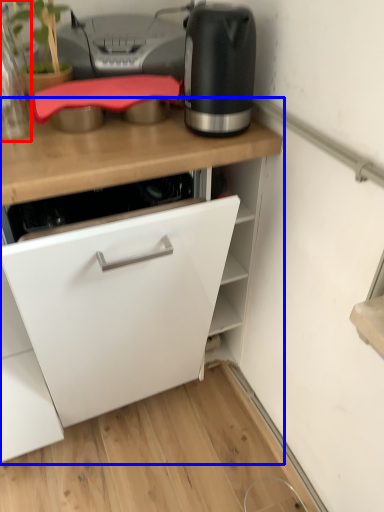
Question: Among these objects, which one is nearest to the camera, kitchen appliance (highlighted by a red box) or cabinetry (highlighted by a blue box)?

Choices:
 (A) kitchen appliance
 (B) cabinetry

Answer: (B)